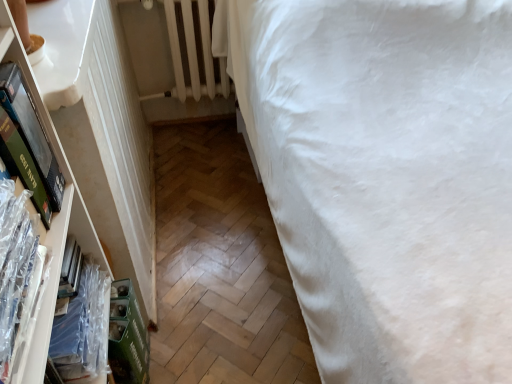
The width and height of the screenshot is (512, 384). In order to click on free space above clear plastic book at left, which ranks as the 1th book in back-to-front order (from a real-world perspective) in this screenshot , I will do `click(72, 305)`.